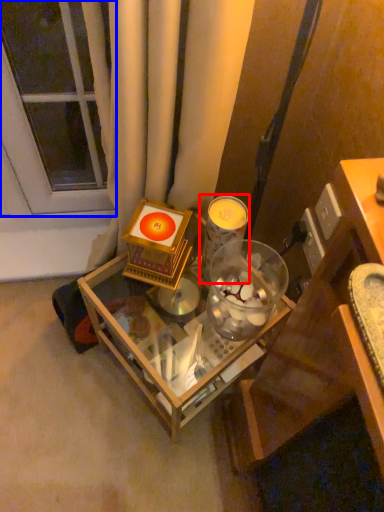
Question: Among these objects, which one is farthest to the camera, candle holder (highlighted by a red box) or glass door (highlighted by a blue box)?

Choices:
 (A) candle holder
 (B) glass door

Answer: (B)